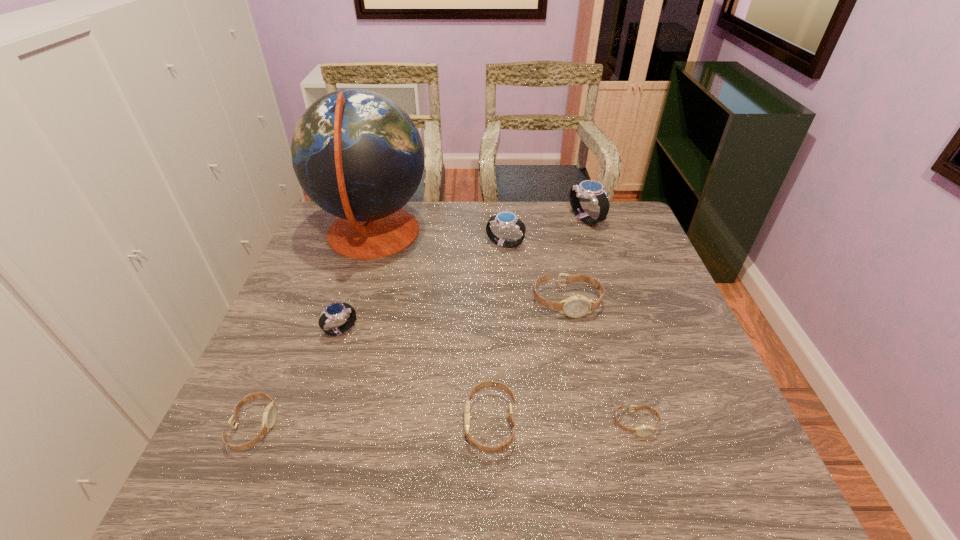
This screenshot has height=540, width=960. I want to click on blank region between the biggest beige watch and the shortest object, so click(601, 363).

Image resolution: width=960 pixels, height=540 pixels. I want to click on empty location between the second tallest watch and the tallest object, so click(x=439, y=240).

The height and width of the screenshot is (540, 960). I want to click on free space between the shortest object and the leftmost silver watch, so click(x=489, y=377).

Identify the location of the third closest object relative to the farthest silver watch. (357, 154).

Choose which object is the third nearest neighbor to the second silver watch from right to left. Please provide its 2D coordinates. Your answer should be formatted as a tuple, i.e. [(x, y)], where the tuple contains the x and y coordinates of a point satisfying the conditions above.

[(357, 154)]

This screenshot has width=960, height=540. What are the coordinates of `watch that can be found as the fifth closest to the tallest object` in the screenshot? It's located at (270, 412).

This screenshot has height=540, width=960. Find the location of `watch that is the third closest one to the second farthest watch`. watch that is the third closest one to the second farthest watch is located at coordinates (335, 311).

Identify which silver watch is the third closest to the tallest object. Please provide its 2D coordinates. Your answer should be formatted as a tuple, i.e. [(x, y)], where the tuple contains the x and y coordinates of a point satisfying the conditions above.

[(589, 189)]

Identify which silver watch is located as the second nearest to the fourth nearest object. Please provide its 2D coordinates. Your answer should be formatted as a tuple, i.e. [(x, y)], where the tuple contains the x and y coordinates of a point satisfying the conditions above.

[(589, 189)]

Identify which beige watch is the third nearest to the tallest object. Please provide its 2D coordinates. Your answer should be formatted as a tuple, i.e. [(x, y)], where the tuple contains the x and y coordinates of a point satisfying the conditions above.

[(270, 412)]